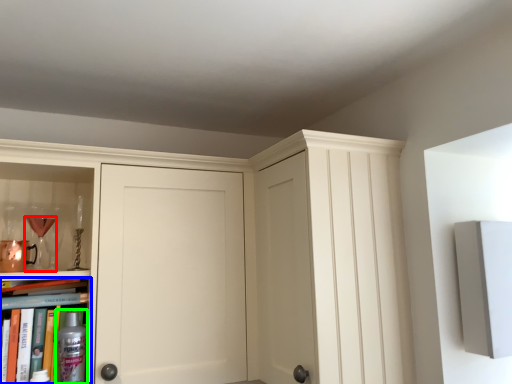
Question: Which object is positioned farthest from wine glass (highlighted by a red box)? Select from book (highlighted by a blue box) and bottle (highlighted by a green box).

Choices:
 (A) book
 (B) bottle

Answer: (B)